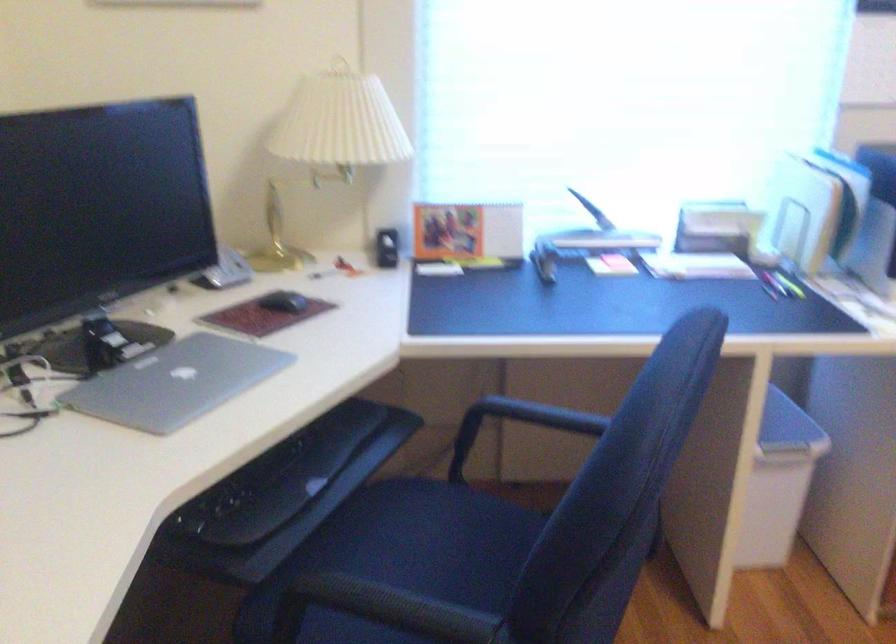
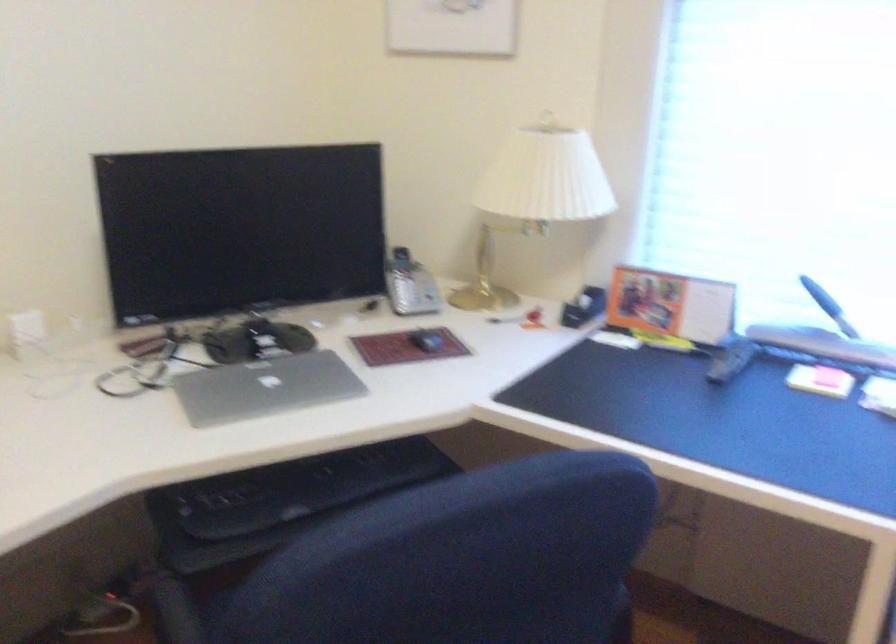
In the second image, find the point that corresponds to (x=207, y=252) in the first image.

(401, 281)